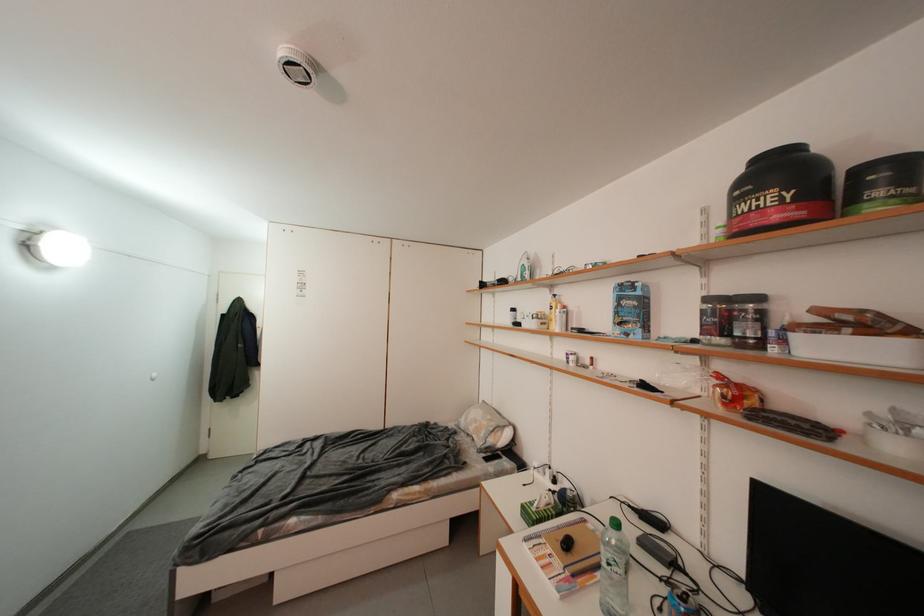
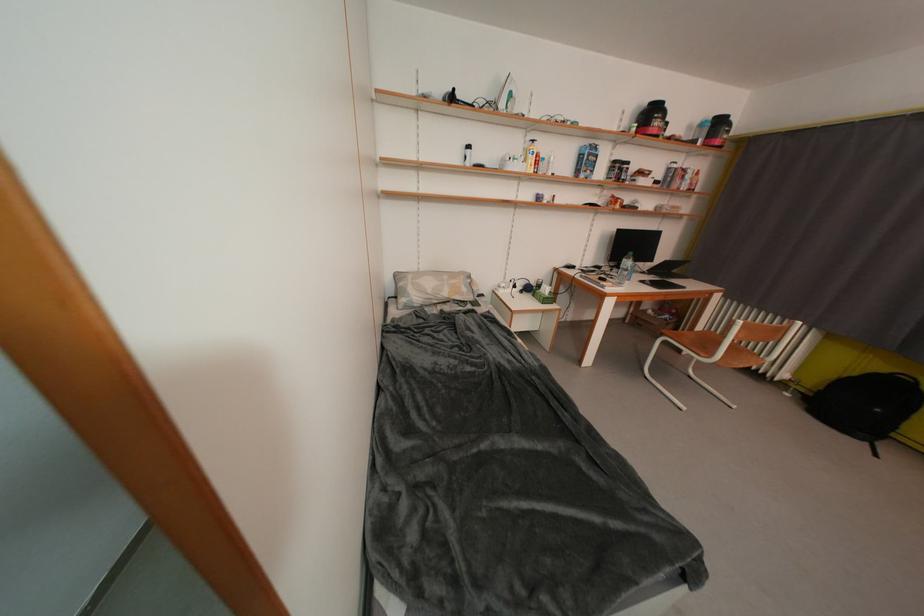
Find the pixel in the second image that matches the point at 490,437 in the first image.

(471, 293)